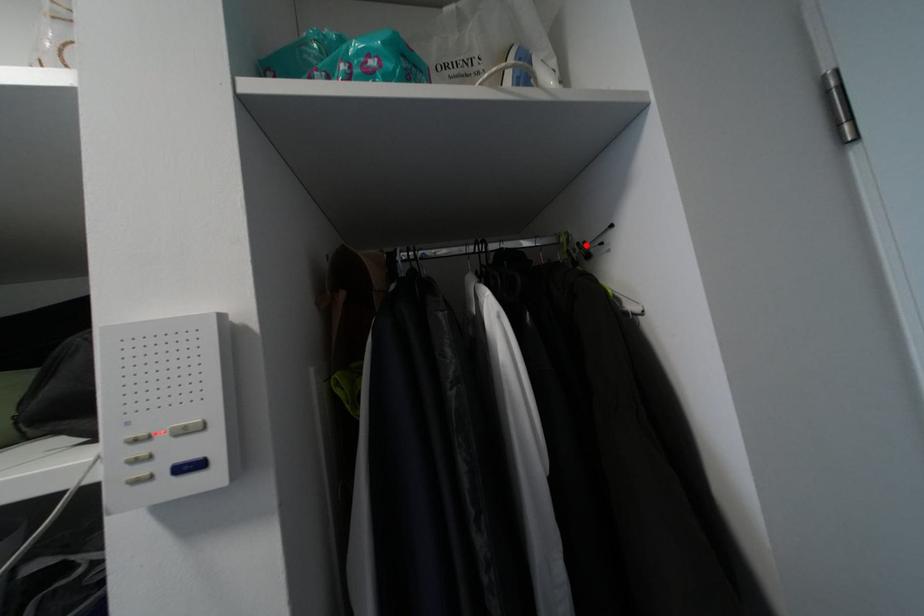
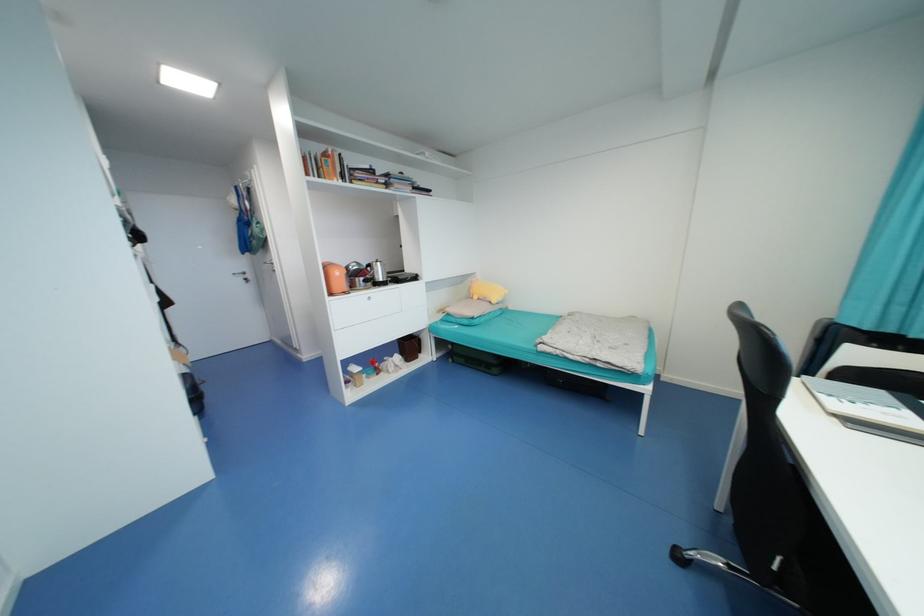
Question: I am providing you with two images of the same scene from different viewpoints. A red point is marked on the first image. Can you still see the location of the red point in image 2?

Choices:
 (A) Yes
 (B) No

Answer: (B)